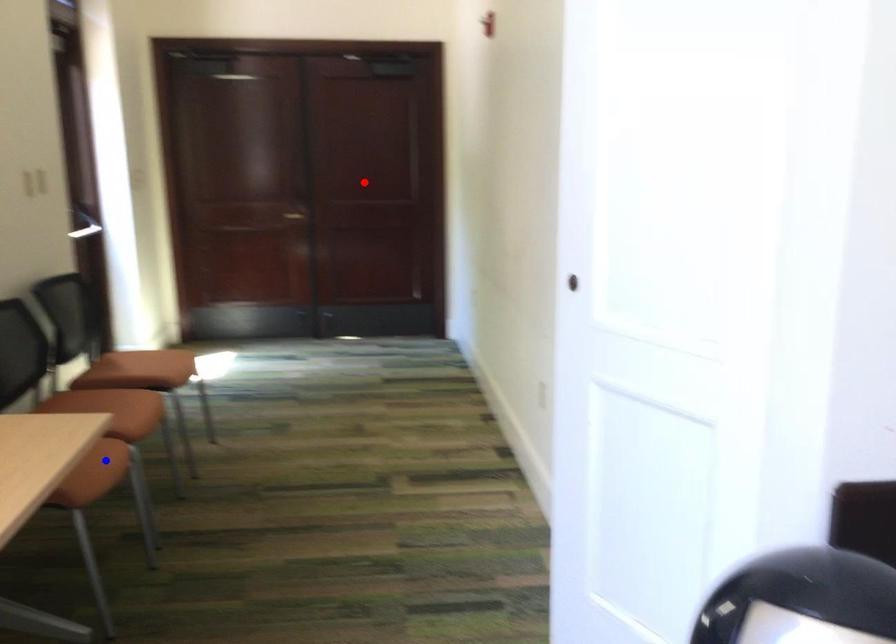
Question: Two points are marked on the image. Which point is closer to the camera?

Choices:
 (A) Blue point is closer.
 (B) Red point is closer.

Answer: (A)